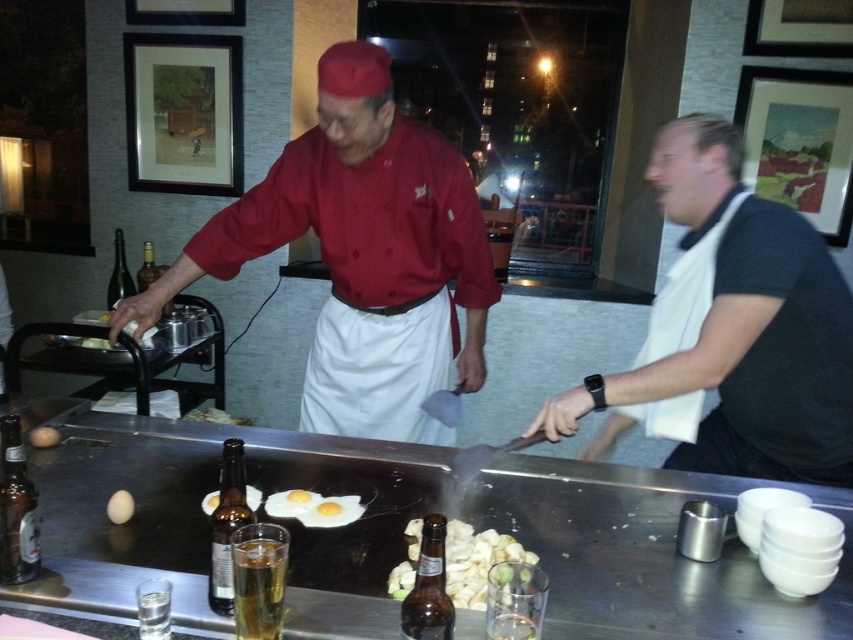
Question: Is matte red chef's jacket at center above translucent glass bottle at left?

Choices:
 (A) yes
 (B) no

Answer: (B)

Question: Which is farther from the translucent glass beer at center?

Choices:
 (A) metallic silver tong at center
 (B) amber glass bottle at center

Answer: (A)

Question: Which is farther from the white matte egg at center?

Choices:
 (A) amber glass bottle at center
 (B) translucent glass beer bottle at center
 (C) brown glass bottle at lower left
 (D) white cotton apron at center

Answer: (D)

Question: Estimate the real-world distances between objects in this image. Which object is closer to the white cotton apron at center?

Choices:
 (A) white towel at right
 (B) white matte egg at center
 (C) brown glass bottle at lower left
 (D) metallic silver tong at center

Answer: (D)

Question: Does white glossy vegetables at center appear under translucent glass beer at center?

Choices:
 (A) yes
 (B) no

Answer: (A)

Question: Is the position of white glossy vegetables at center more distant than that of translucent glass beer at center?

Choices:
 (A) yes
 (B) no

Answer: (A)